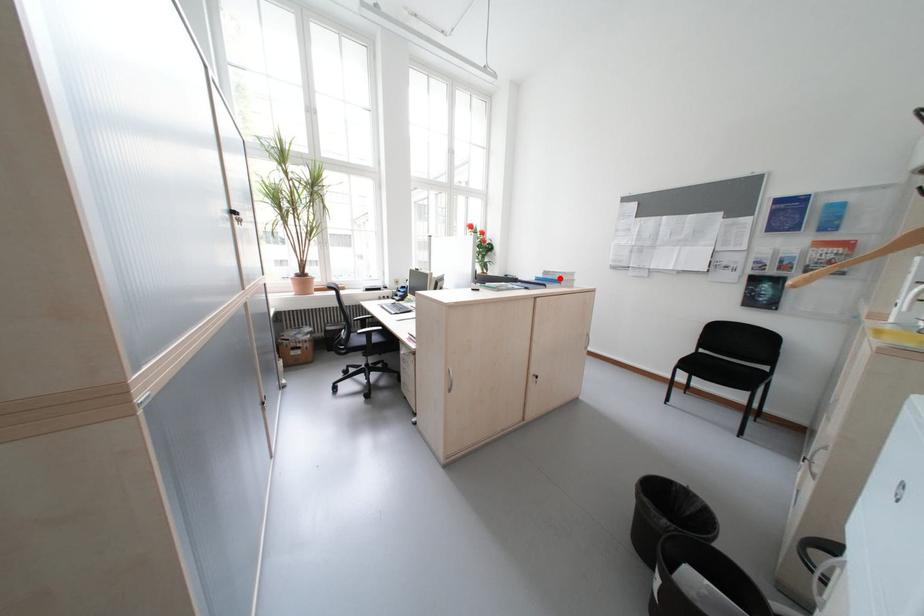
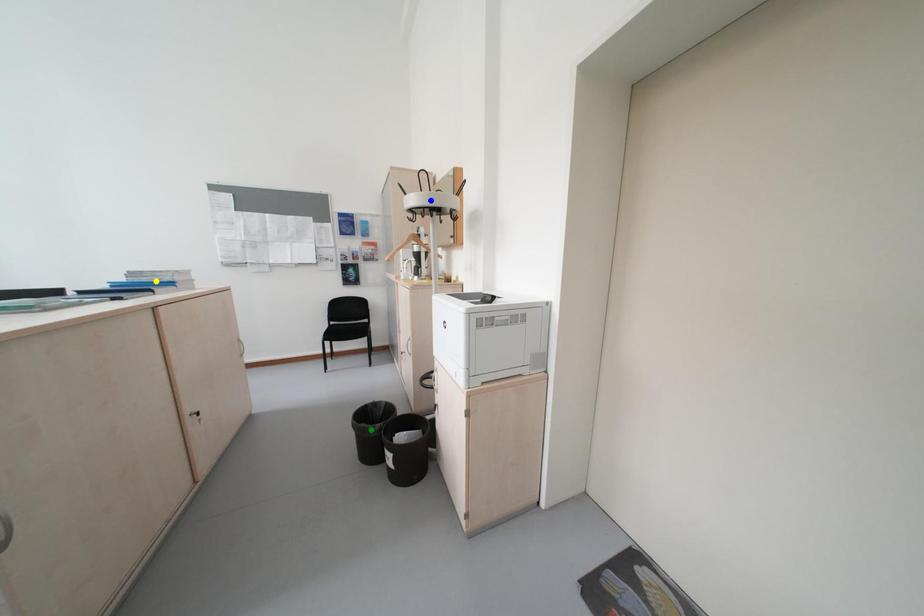
Question: I am providing you with two images of the same scene from different viewpoints. A red point is marked on the first image. You are given multiple points on the second image. Which spot in image 2 lines up with the point in image 1?

Choices:
 (A) blue point
 (B) green point
 (C) yellow point

Answer: (C)